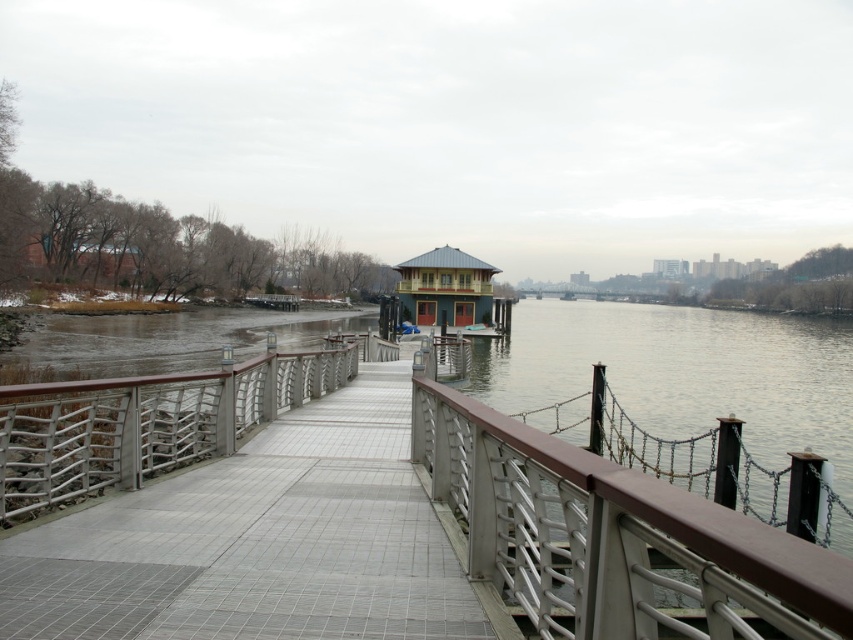
Is brown metallic railing at right behind silver metallic railing at center?

No, brown metallic railing at right is in front of silver metallic railing at center.

Between brown metallic railing at right and silver metallic railing at center, which one is positioned higher?

Positioned higher is brown metallic railing at right.

Between point (585, 579) and point (26, 426), which one is positioned behind?

The point (26, 426) is behind.

Image resolution: width=853 pixels, height=640 pixels. In order to click on brown metallic railing at right in this screenshot , I will do `click(613, 538)`.

Between silver metallic railing at center and teal matte gazebo at center, which one has more height?

teal matte gazebo at center is taller.

Is silver metallic railing at center to the right of teal matte gazebo at center from the viewer's perspective?

No, silver metallic railing at center is not to the right of teal matte gazebo at center.

You are a GUI agent. You are given a task and a screenshot of the screen. Output one action in this format:
    pyautogui.click(x=<x>, y=<y>)
    Task: Click on the silver metallic railing at center
    This screenshot has height=640, width=853.
    Given the screenshot: What is the action you would take?
    pyautogui.click(x=146, y=422)

Does metallic silver dock at center appear on the left side of teal matte gazebo at center?

Indeed, metallic silver dock at center is positioned on the left side of teal matte gazebo at center.

Is point (222, 520) farther from camera compared to point (469, 289)?

No, it is not.

The image size is (853, 640). In order to click on metallic silver dock at center in this screenshot , I will do `click(258, 541)`.